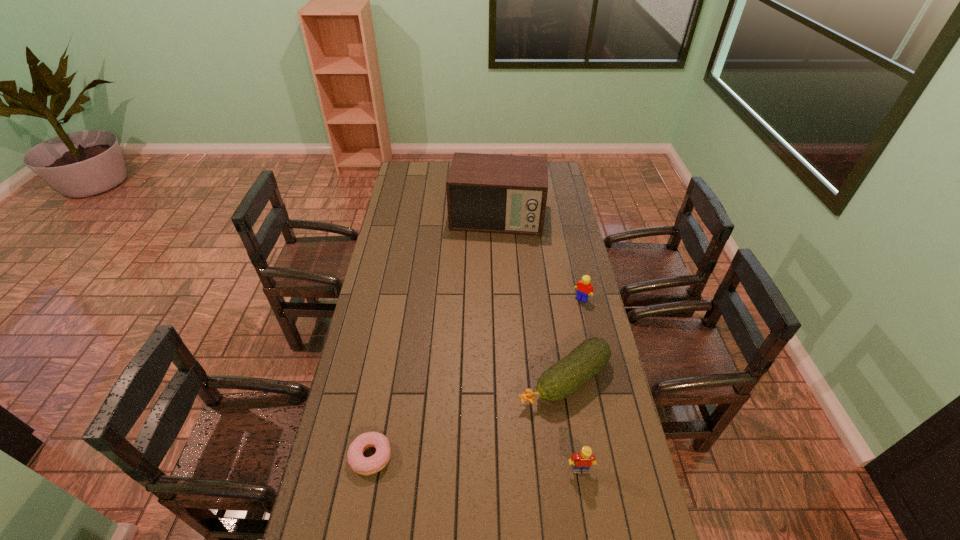
Locate an element on the screen. free space that is in between the leftmost object and the farthest object is located at coordinates (434, 337).

Locate an element on the screen. unoccupied position between the shortest object and the nearer Lego is located at coordinates (475, 463).

You are a GUI agent. You are given a task and a screenshot of the screen. Output one action in this format:
    pyautogui.click(x=<x>, y=<y>)
    Task: Click on the vacant area between the third nearest object and the leftmost object
    The image size is (960, 540).
    Given the screenshot: What is the action you would take?
    click(x=468, y=417)

Where is `vacant point located between the right Lego and the radio receiver`? Image resolution: width=960 pixels, height=540 pixels. vacant point located between the right Lego and the radio receiver is located at coordinates (540, 258).

The height and width of the screenshot is (540, 960). I want to click on free spot between the fourth tallest object and the right Lego, so click(x=573, y=339).

Identify which object is the second closest to the second shortest object. Please provide its 2D coordinates. Your answer should be formatted as a tuple, i.e. [(x, y)], where the tuple contains the x and y coordinates of a point satisfying the conditions above.

[(584, 286)]

Identify the location of object that is the second closest to the nearer Lego. [x=359, y=464].

Where is `vacant region that satisfies the following two spatial constraints: 1. on the front side of the farthest object; 2. on the left side of the cucumber`? vacant region that satisfies the following two spatial constraints: 1. on the front side of the farthest object; 2. on the left side of the cucumber is located at coordinates (505, 379).

In order to click on vacant region that satisfies the following two spatial constraints: 1. on the front side of the fourth nearest object; 2. on the left side of the farthest object in this screenshot , I will do `click(501, 299)`.

Locate an element on the screen. vacant position in the image that satisfies the following two spatial constraints: 1. on the back side of the right Lego; 2. on the right side of the third nearest object is located at coordinates (551, 299).